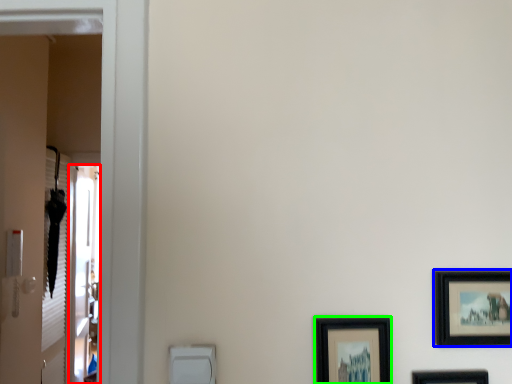
Question: Which is farther away from screen door (highlighted by a red box)? picture frame (highlighted by a blue box) or picture frame (highlighted by a green box)?

Choices:
 (A) picture frame
 (B) picture frame

Answer: (A)